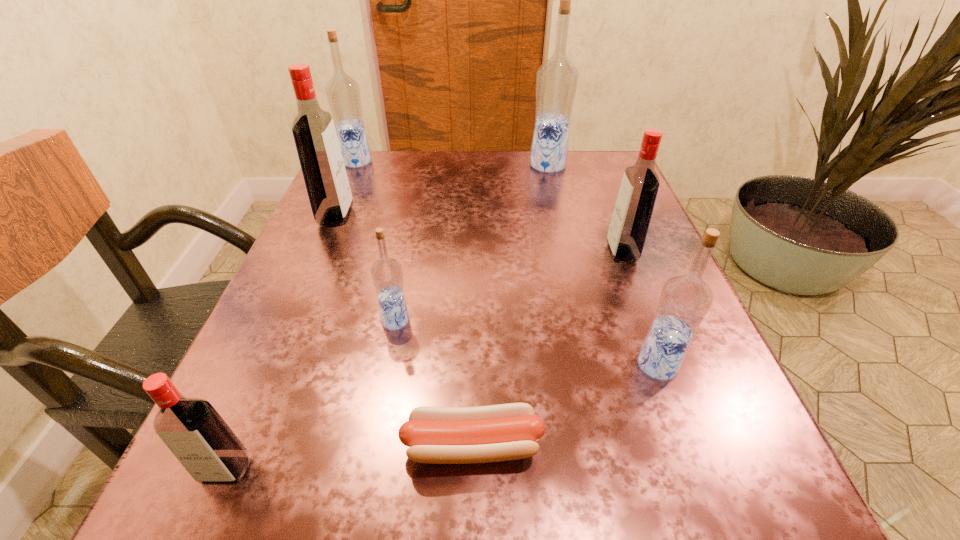
Locate which red vodka is the closest to the second nearest red vodka. Please provide its 2D coordinates. Your answer should be formatted as a tuple, i.e. [(x, y)], where the tuple contains the x and y coordinates of a point satisfying the conditions above.

[(313, 129)]

Where is `vacant area in the image that satisfies the following two spatial constraints: 1. on the front side of the rightmost blue vodka; 2. on the right side of the third blue vodka from right to left`? The image size is (960, 540). vacant area in the image that satisfies the following two spatial constraints: 1. on the front side of the rightmost blue vodka; 2. on the right side of the third blue vodka from right to left is located at coordinates (387, 364).

This screenshot has width=960, height=540. In order to click on free spot that satisfies the following two spatial constraints: 1. on the back side of the third nearest vodka; 2. on the right side of the biggest blue vodka in this screenshot , I will do `click(425, 165)`.

Where is `vacant space that satisfies the following two spatial constraints: 1. on the front and back of the third nearest vodka; 2. on the right side of the fifth nearest vodka`? vacant space that satisfies the following two spatial constraints: 1. on the front and back of the third nearest vodka; 2. on the right side of the fifth nearest vodka is located at coordinates (291, 321).